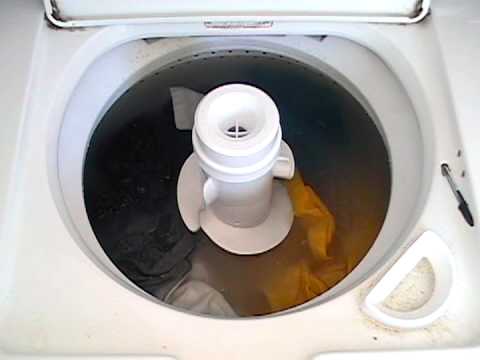
Find the location of a particular element. This screenshot has width=480, height=360. liquid dispenser is located at coordinates (415, 295).